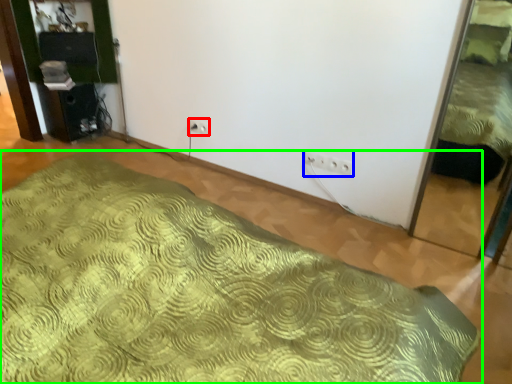
Question: Estimate the real-world distances between objects in this image. Which object is closer to electric outlet (highlighted by a red box), electric outlet (highlighted by a blue box) or bed (highlighted by a green box)?

Choices:
 (A) electric outlet
 (B) bed

Answer: (A)